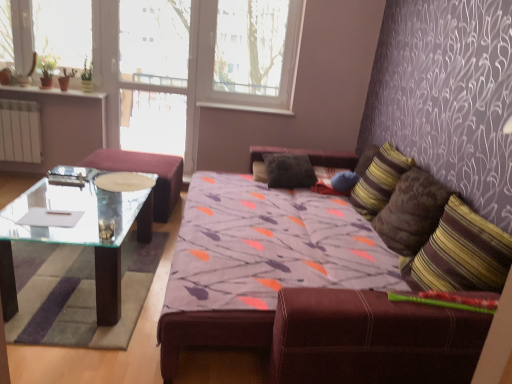
Question: Can you confirm if striped fabric pillow at right, marked as the second pillow in a left-to-right arrangement, is shorter than white plastic window sill at upper center?

Choices:
 (A) yes
 (B) no

Answer: (B)

Question: From the image's perspective, is striped fabric pillow at right, marked as the second pillow in a right-to-left arrangement, located beneath white plastic window sill at upper center?

Choices:
 (A) no
 (B) yes

Answer: (B)

Question: Can we say striped fabric pillow at right, the second pillow when ordered from front to back, lies outside white plastic window sill at upper center?

Choices:
 (A) yes
 (B) no

Answer: (A)

Question: Is striped fabric pillow at right, the second pillow when ordered from front to back, directly adjacent to white plastic window sill at upper center?

Choices:
 (A) no
 (B) yes

Answer: (A)

Question: From the image's perspective, is striped fabric pillow at right, marked as the second pillow in a right-to-left arrangement, on top of white plastic window sill at upper center?

Choices:
 (A) no
 (B) yes

Answer: (A)

Question: Is striped fabric pillow at right, marked as the second pillow in a right-to-left arrangement, aimed at white plastic window sill at upper center?

Choices:
 (A) yes
 (B) no

Answer: (B)

Question: From a real-world perspective, is brown textured pillow at right, the first pillow positioned from the right, over white paper at left?

Choices:
 (A) no
 (B) yes

Answer: (B)

Question: Is brown textured pillow at right, acting as the 3th pillow starting from the back, far from white paper at left?

Choices:
 (A) yes
 (B) no

Answer: (A)

Question: Considering the relative sizes of brown textured pillow at right, marked as the first pillow in a front-to-back arrangement, and white paper at left in the image provided, is brown textured pillow at right, marked as the first pillow in a front-to-back arrangement, wider than white paper at left?

Choices:
 (A) no
 (B) yes

Answer: (B)

Question: Is brown textured pillow at right, acting as the 3th pillow starting from the back, smaller than white paper at left?

Choices:
 (A) yes
 (B) no

Answer: (B)

Question: From the image's perspective, does brown textured pillow at right, acting as the 3th pillow starting from the back, appear lower than white paper at left?

Choices:
 (A) yes
 (B) no

Answer: (B)

Question: Is brown textured pillow at right, acting as the 3th pillow starting from the back, oriented towards white paper at left?

Choices:
 (A) no
 (B) yes

Answer: (B)

Question: Considering the relative sizes of white paper at left and white plastic window frame at upper center in the image provided, is white paper at left thinner than white plastic window frame at upper center?

Choices:
 (A) no
 (B) yes

Answer: (A)